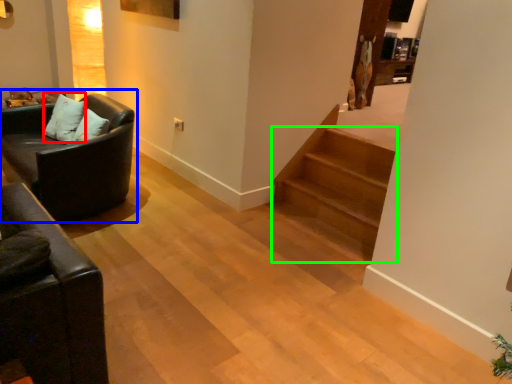
Question: Based on their relative distances, which object is nearer to pillow (highlighted by a red box)? Choose from studio couch (highlighted by a blue box) and stairs (highlighted by a green box).

Choices:
 (A) studio couch
 (B) stairs

Answer: (A)